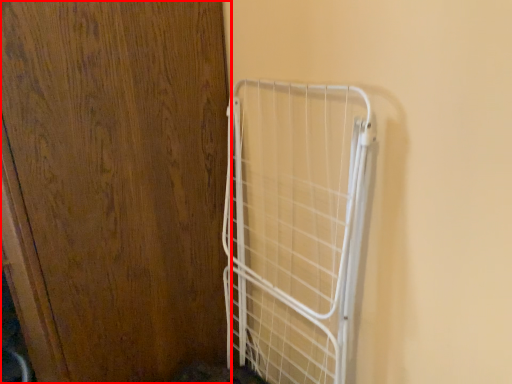
Question: Where is door (annotated by the red box) located in relation to cage in the image?

Choices:
 (A) left
 (B) right

Answer: (A)